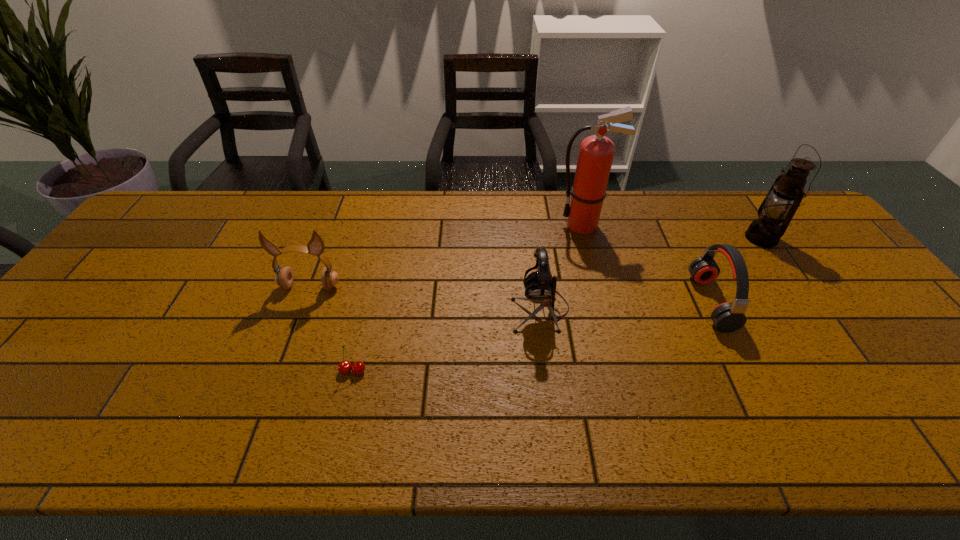
Where is `fire extinguisher`? The height and width of the screenshot is (540, 960). fire extinguisher is located at coordinates (596, 152).

This screenshot has width=960, height=540. Identify the location of the tallest object. (596, 152).

This screenshot has width=960, height=540. I want to click on the rightmost object, so click(x=784, y=197).

The image size is (960, 540). Identify the location of oil lamp. coord(784,197).

The height and width of the screenshot is (540, 960). In order to click on the second earphone from left to right in this screenshot , I will do `click(540, 287)`.

I want to click on the leftmost object, so click(284, 277).

Where is `the shortest earphone`? Image resolution: width=960 pixels, height=540 pixels. the shortest earphone is located at coordinates [x=727, y=317].

Identify the location of the rightmost earphone. The height and width of the screenshot is (540, 960). (727, 317).

Where is `the second object from left to right`? the second object from left to right is located at coordinates (344, 367).

This screenshot has height=540, width=960. What are the coordinates of `the shortest object` in the screenshot? It's located at (344, 367).